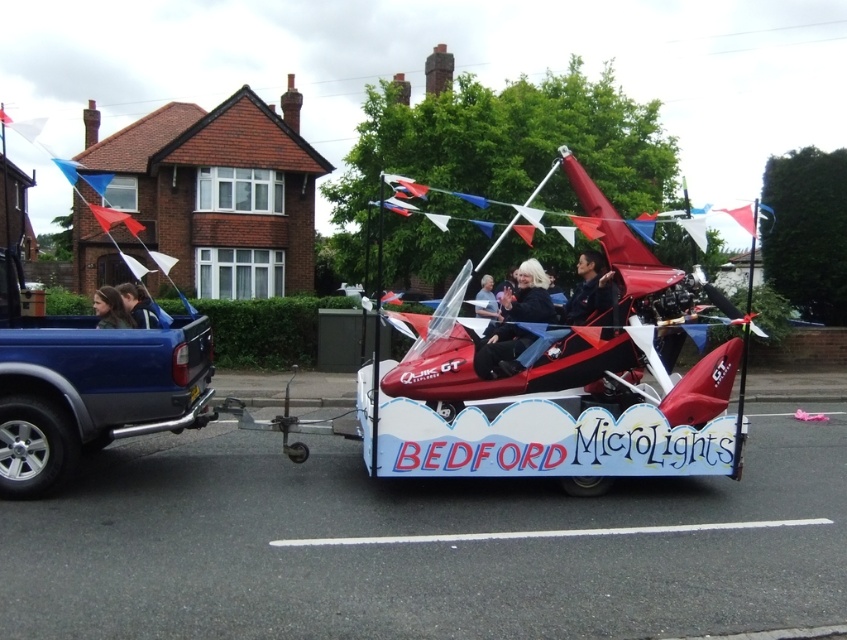
Question: Is black fabric jacket at center below blonde hair at center?

Choices:
 (A) yes
 (B) no

Answer: (A)

Question: Which object is the farthest from the blonde hair at left?

Choices:
 (A) black fabric jacket at center
 (B) light brown leather jacket at center

Answer: (B)

Question: Which of the following is the closest to the observer?

Choices:
 (A) coord(573,307)
 (B) coord(497,307)

Answer: (A)

Question: Which of the following is the closest to the observer?

Choices:
 (A) (590, 262)
 (B) (139, 312)
 (C) (529, 280)

Answer: (C)

Question: Does matte black jacket at center have a lesser width compared to light brown leather jacket at center?

Choices:
 (A) no
 (B) yes

Answer: (A)

Question: Does matte black jacket at center come behind blonde hair at center?

Choices:
 (A) no
 (B) yes

Answer: (A)